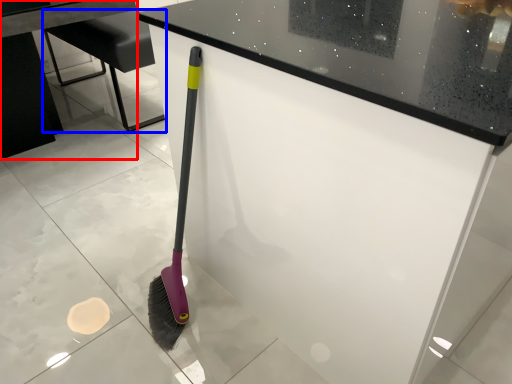
Question: Which object appears farthest to the camera in this image, table (highlighted by a red box) or furniture (highlighted by a blue box)?

Choices:
 (A) table
 (B) furniture

Answer: (B)